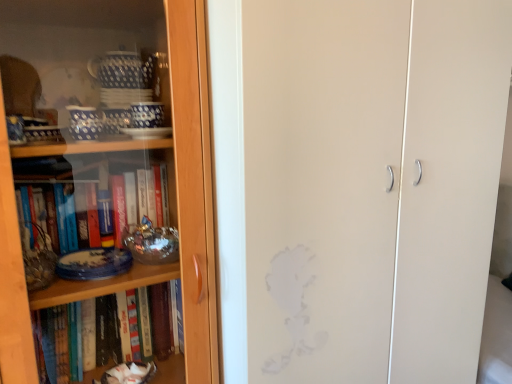
Question: Is wooden bookcase at left to the left or to the right of matte white cabinet at center in the image?

Choices:
 (A) left
 (B) right

Answer: (A)

Question: Considering the positions of point (202, 66) and point (343, 112), is point (202, 66) closer or farther from the camera than point (343, 112)?

Choices:
 (A) farther
 (B) closer

Answer: (B)

Question: From the image's perspective, is wooden bookcase at left located above or below matte white cabinet at center?

Choices:
 (A) below
 (B) above

Answer: (B)

Question: From the image's perspective, is matte white cabinet at center positioned above or below wooden bookcase at left?

Choices:
 (A) below
 (B) above

Answer: (A)

Question: Would you say matte white cabinet at center is inside or outside wooden bookcase at left?

Choices:
 (A) inside
 (B) outside

Answer: (B)

Question: In terms of width, does matte white cabinet at center look wider or thinner when compared to wooden bookcase at left?

Choices:
 (A) thin
 (B) wide

Answer: (B)

Question: Is matte white cabinet at center to the left or to the right of wooden bookcase at left in the image?

Choices:
 (A) right
 (B) left

Answer: (A)